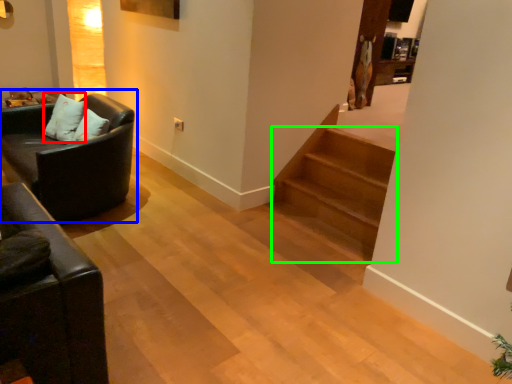
Question: Based on their relative distances, which object is farther from pillow (highlighted by a red box)? Choose from studio couch (highlighted by a blue box) and stairs (highlighted by a green box).

Choices:
 (A) studio couch
 (B) stairs

Answer: (B)